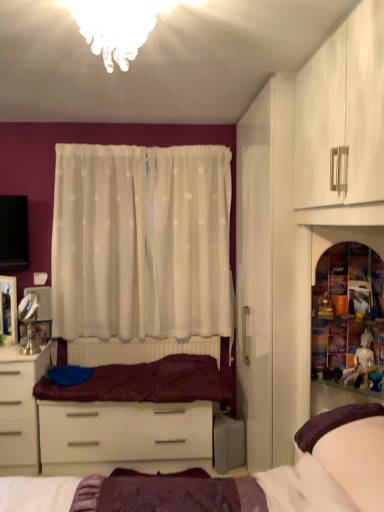
Question: Should I look upward or downward to see translucent glass chandelier at upper center?

Choices:
 (A) down
 (B) up

Answer: (B)

Question: Is translucent glass chandelier at upper center positioned before white glossy desk at lower left?

Choices:
 (A) no
 (B) yes

Answer: (B)

Question: Does translucent glass chandelier at upper center have a smaller size compared to white glossy desk at lower left?

Choices:
 (A) no
 (B) yes

Answer: (B)

Question: Is translucent glass chandelier at upper center further to camera compared to white glossy desk at lower left?

Choices:
 (A) no
 (B) yes

Answer: (A)

Question: Is white glossy desk at lower left surrounded by translucent glass chandelier at upper center?

Choices:
 (A) no
 (B) yes

Answer: (A)

Question: Is translucent glass chandelier at upper center outside white glossy desk at lower left?

Choices:
 (A) yes
 (B) no

Answer: (A)

Question: From the image's perspective, is translucent glass chandelier at upper center on white glossy desk at lower left?

Choices:
 (A) no
 (B) yes

Answer: (B)

Question: From a real-world perspective, is white sheer curtain at center over silver/metallic makeup mirror at left?

Choices:
 (A) yes
 (B) no

Answer: (A)

Question: Could silver/metallic makeup mirror at left be considered to be inside white sheer curtain at center?

Choices:
 (A) yes
 (B) no

Answer: (B)

Question: Is white sheer curtain at center to the left of silver/metallic makeup mirror at left from the viewer's perspective?

Choices:
 (A) no
 (B) yes

Answer: (A)

Question: From the image's perspective, is white sheer curtain at center under silver/metallic makeup mirror at left?

Choices:
 (A) no
 (B) yes

Answer: (A)

Question: Is white sheer curtain at center closer to camera compared to silver/metallic makeup mirror at left?

Choices:
 (A) no
 (B) yes

Answer: (A)

Question: Does white sheer curtain at center have a greater width compared to silver/metallic makeup mirror at left?

Choices:
 (A) no
 (B) yes

Answer: (B)

Question: From a real-world perspective, is translucent glass shelf at right under white glossy desk at lower left?

Choices:
 (A) no
 (B) yes

Answer: (A)